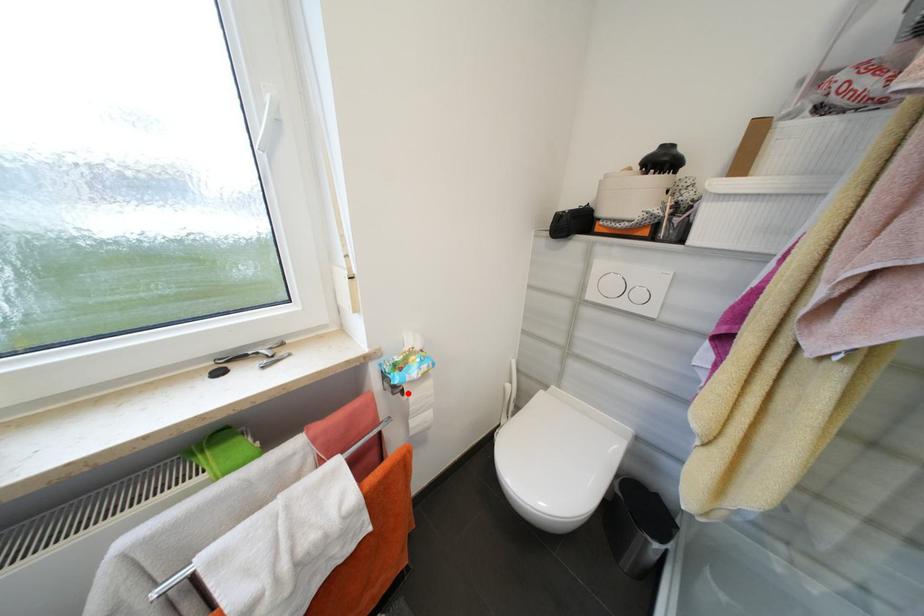
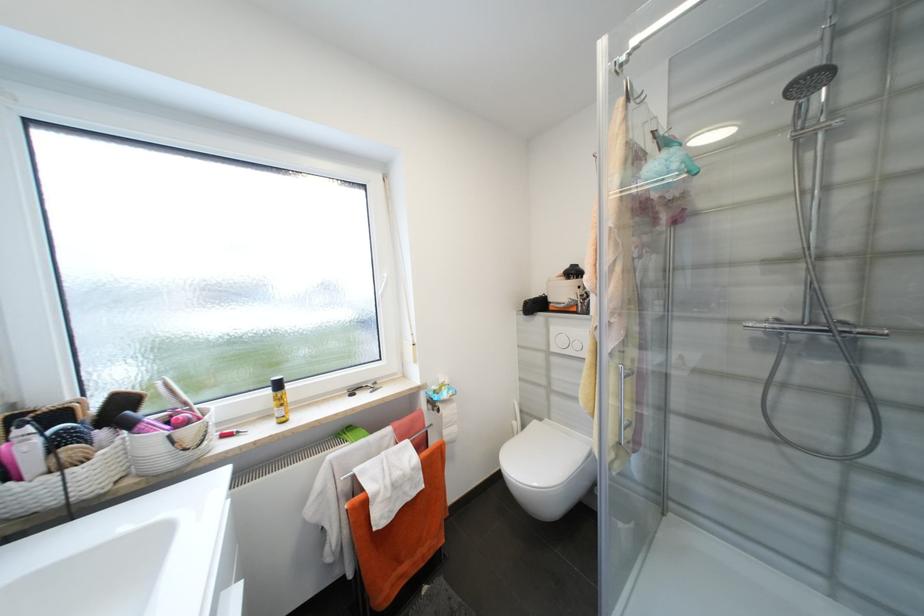
In the second image, find the point that corresponds to the highlighted location in the first image.

(444, 411)